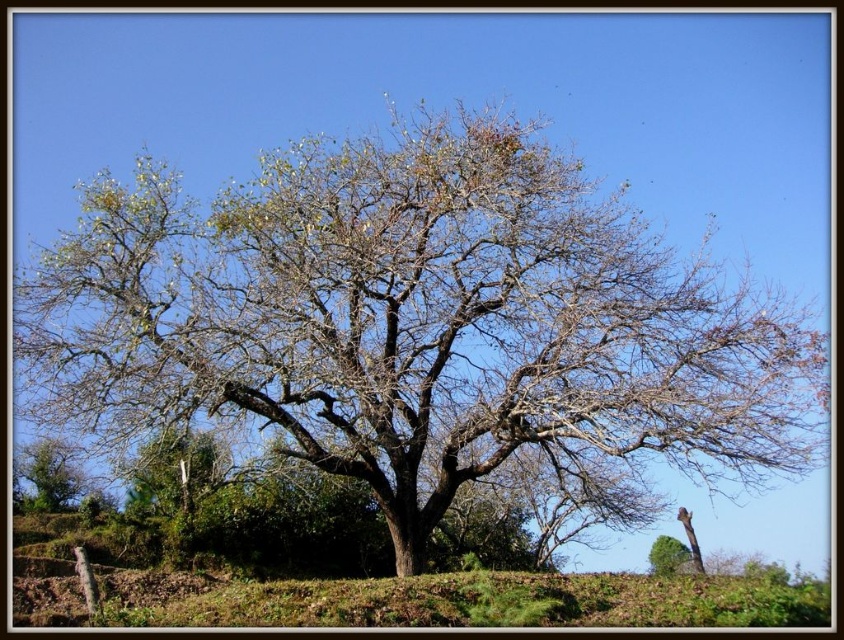
You are planning to plant a new tree in your backyard. You have a seedling that requires a planting area twice the size of the green leafy tree at lower right. Based on the image, is the brown soil at center sufficient for planting the seedling?

The brown soil at center is bigger than the green leafy tree at lower right, so it should be sufficient to plant the seedling requiring twice the size of the green leafy tree at lower right.

You are standing in a park and see two trees, the green leafy tree at lower left and the green leafy tree at lower right. Which tree is taller?

The green leafy tree at lower left is taller than the green leafy tree at lower right.

You are a gardener who wants to plant a new flower bed between the brown soil at center and the green leafy tree at lower right. Considering their positions, which object is closer to the ground and why?

The green leafy tree at lower right is closer to the ground because the brown soil at center is taller than it, meaning the tree is positioned lower in height compared to the soil.